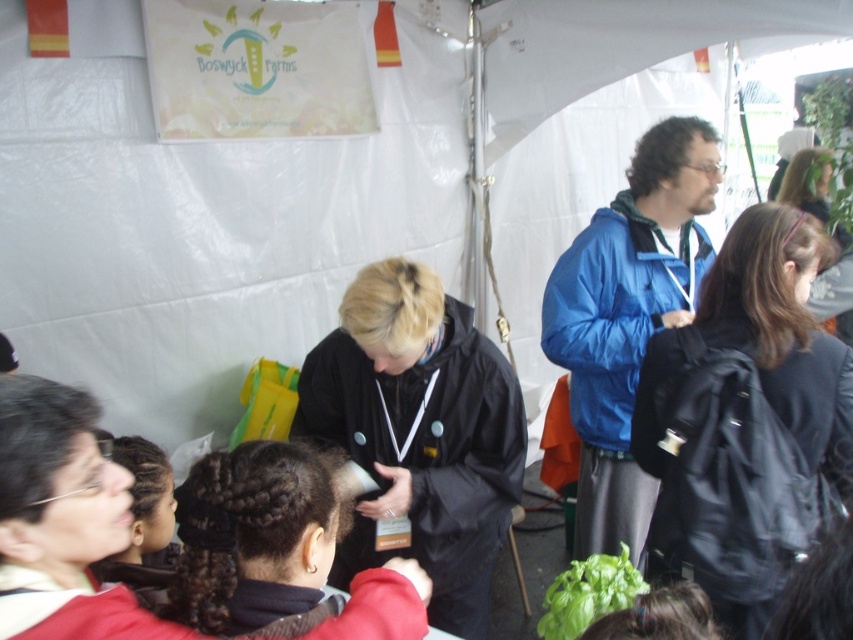
You are at the Boswyck Farms event and want to approach the person in the black matte jacket at center. Which direction should you move relative to the smooth black hair at upper right?

To reach the black matte jacket at center, you should move to the left of the smooth black hair at upper right since the black matte jacket at center is positioned to the left of it.